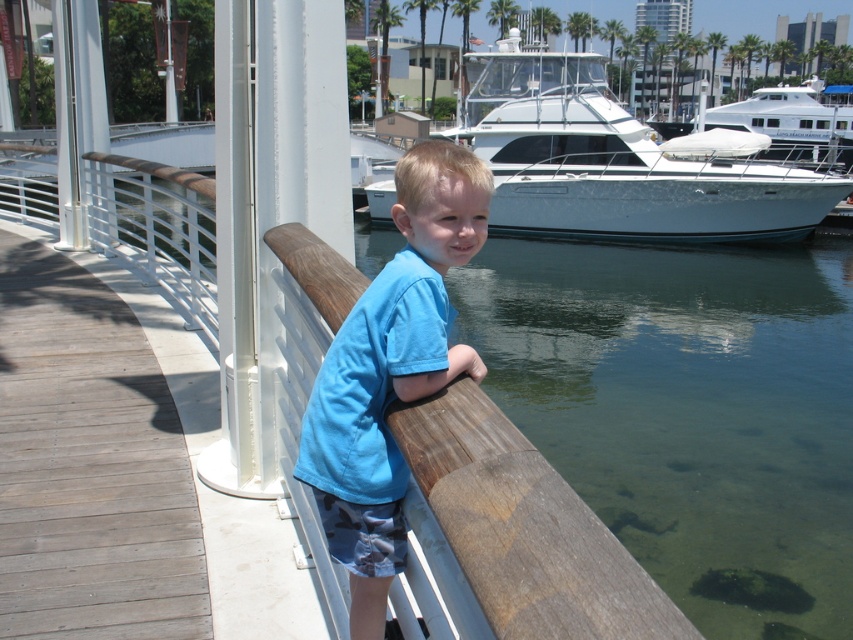
Who is taller, gray wood deck at lower left or white glossy boat at upper center?

white glossy boat at upper center

Who is higher up, gray wood deck at lower left or white glossy boat at upper center?

white glossy boat at upper center

Who is more distant from viewer, (16,246) or (759,204)?

Positioned behind is point (759,204).

The height and width of the screenshot is (640, 853). In order to click on gray wood deck at lower left in this screenshot , I will do pos(88,465).

Which is below, gray wood deck at lower left or blue cotton shirt at center?

gray wood deck at lower left

From the picture: Is gray wood deck at lower left to the right of blue cotton shirt at center from the viewer's perspective?

Incorrect, gray wood deck at lower left is not on the right side of blue cotton shirt at center.

The height and width of the screenshot is (640, 853). Find the location of `gray wood deck at lower left`. gray wood deck at lower left is located at coordinates (88, 465).

What are the coordinates of `gray wood deck at lower left` in the screenshot? It's located at (88, 465).

Who is positioned more to the left, white glossy boat at upper center or blue cotton shirt at center?

blue cotton shirt at center is more to the left.

Between point (653, 236) and point (297, 464), which one is positioned behind?

Positioned behind is point (653, 236).

Describe the element at coordinates (612, 163) in the screenshot. This screenshot has width=853, height=640. I see `white glossy boat at upper center` at that location.

Identify the location of white glossy boat at upper center. (612, 163).